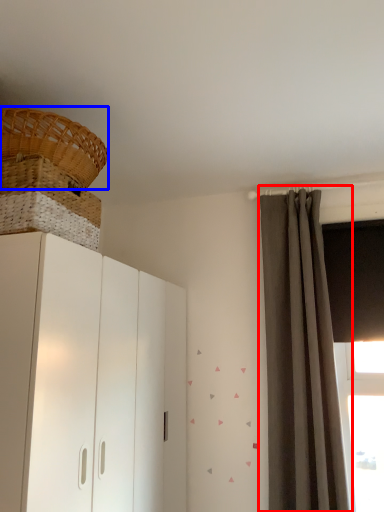
Question: Which point is further to the camera, curtain (highlighted by a red box) or basket (highlighted by a blue box)?

Choices:
 (A) curtain
 (B) basket

Answer: (A)